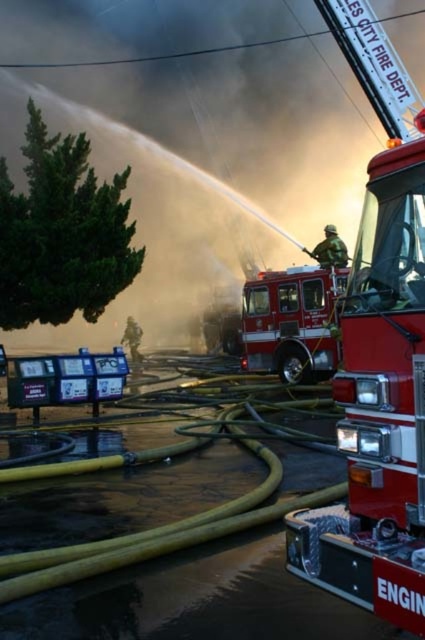
Question: Observing the image, what is the correct spatial positioning of shiny red fire truck at center in reference to camouflage uniform fireman at center?

Choices:
 (A) right
 (B) left

Answer: (A)

Question: Which is farther from the camouflage uniform fireman at center?

Choices:
 (A) red fire truck at center
 (B) yellow rubber hose at center
 (C) green matte uniform at center

Answer: (B)

Question: Where is green matte uniform at center located in relation to camouflage uniform fireman at center in the image?

Choices:
 (A) below
 (B) above

Answer: (B)

Question: Can you confirm if shiny red fire truck at center is positioned below camouflage uniform fireman at center?

Choices:
 (A) no
 (B) yes

Answer: (A)

Question: Which of the following is the farthest from the observer?

Choices:
 (A) (291, 548)
 (B) (229, 525)
 (C) (339, 252)
 (D) (286, 340)

Answer: (C)

Question: Which object is farther from the camera taking this photo?

Choices:
 (A) red fire truck at center
 (B) camouflage uniform fireman at center
 (C) yellow rubber hose at center

Answer: (B)